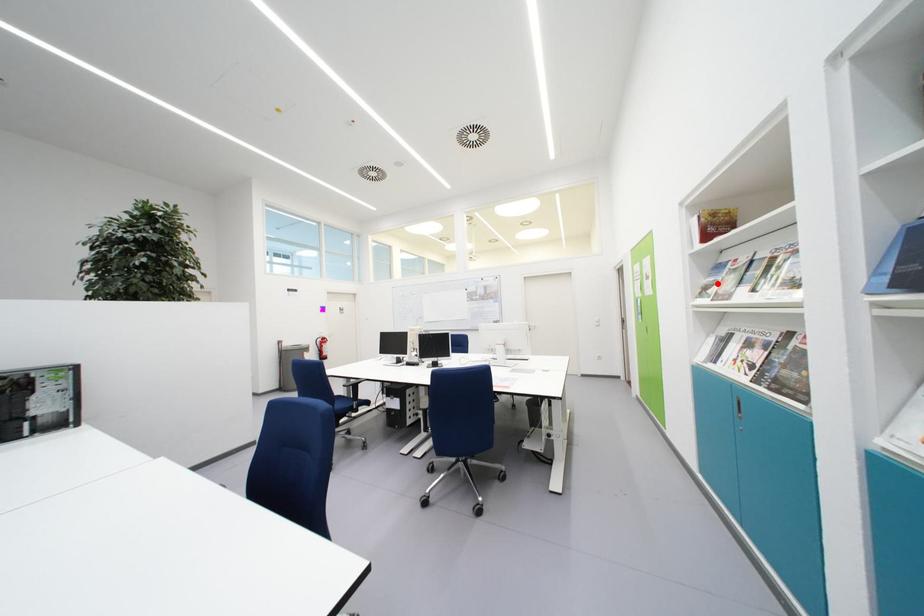
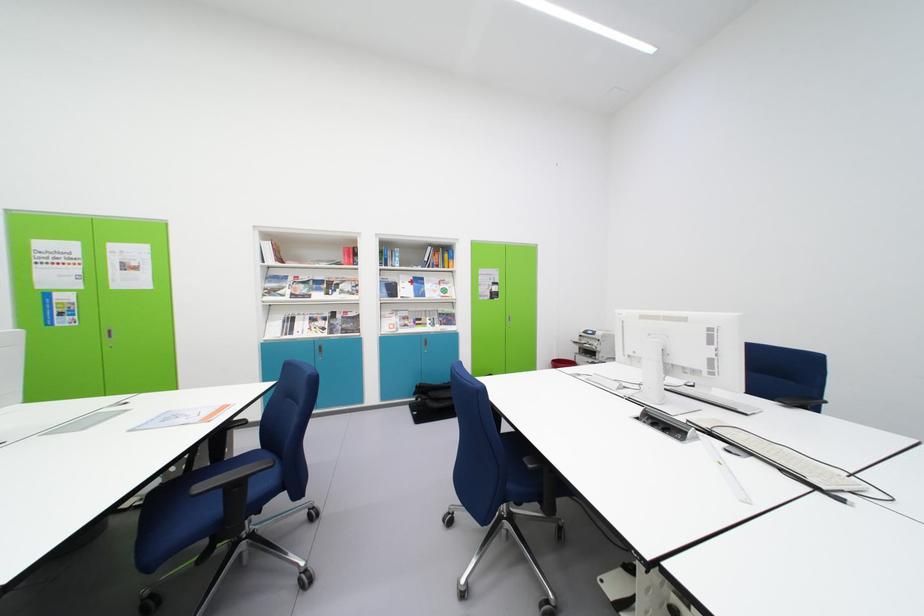
In the second image, find the point that corresponds to the highlighted location in the first image.

(281, 289)